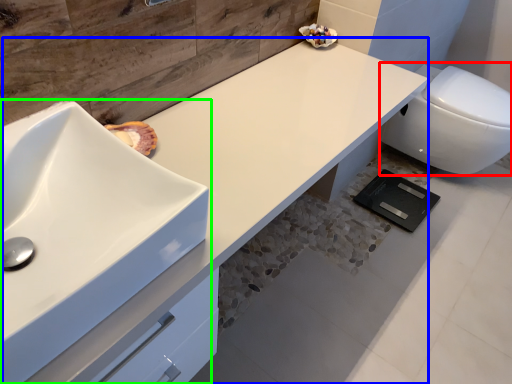
Question: Considering the real-world distances, which object is closest to toilet (highlighted by a red box)? counter top (highlighted by a blue box) or sink (highlighted by a green box).

Choices:
 (A) counter top
 (B) sink

Answer: (A)